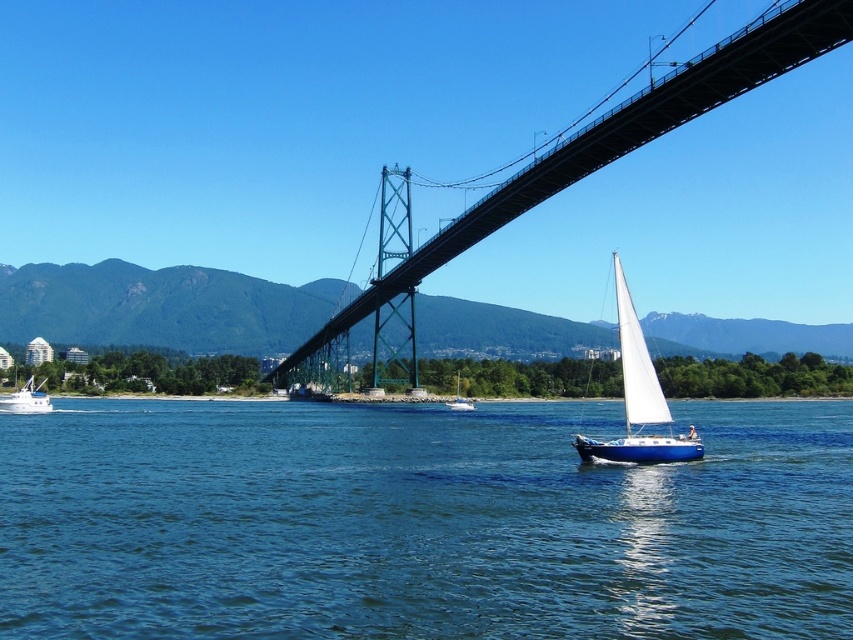
You are standing on the bridge and notice two boats below. The white plastic boat at lower left and the white sailboat at center. Which boat is closer to the bridge?

The white plastic boat at lower left is closer to the bridge because it is positioned above the white sailboat at center, indicating it is nearer in the visual plane.